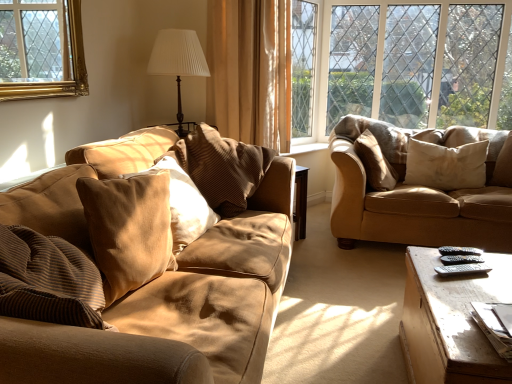
Question: Is suede-like beige pillow at right, positioned as the fourth pillow in left-to-right order, facing away from brown fabric curtain at center?

Choices:
 (A) yes
 (B) no

Answer: (A)

Question: Are suede-like beige pillow at right, positioned as the fourth pillow in left-to-right order, and brown fabric curtain at center beside each other?

Choices:
 (A) yes
 (B) no

Answer: (B)

Question: Is suede-like beige pillow at right, positioned as the fourth pillow in left-to-right order, further to camera compared to brown fabric curtain at center?

Choices:
 (A) yes
 (B) no

Answer: (A)

Question: Considering the relative sizes of suede-like beige pillow at right, which is the second pillow from right to left, and brown fabric curtain at center in the image provided, is suede-like beige pillow at right, which is the second pillow from right to left, thinner than brown fabric curtain at center?

Choices:
 (A) yes
 (B) no

Answer: (B)

Question: Is brown fabric curtain at center surrounded by suede-like beige pillow at right, which is the second pillow from right to left?

Choices:
 (A) yes
 (B) no

Answer: (B)

Question: Based on their sizes in the image, would you say beige soft cushion at right, the fifth pillow in the left-to-right sequence, is bigger or smaller than white pleated fabric at upper center?

Choices:
 (A) big
 (B) small

Answer: (B)

Question: Would you say beige soft cushion at right, the 1th pillow when ordered from right to left, is to the left or to the right of white pleated fabric at upper center in the picture?

Choices:
 (A) right
 (B) left

Answer: (A)

Question: Is beige soft cushion at right, the 1th pillow when ordered from right to left, wider or thinner than white pleated fabric at upper center?

Choices:
 (A) wide
 (B) thin

Answer: (B)

Question: From a real-world perspective, is beige soft cushion at right, the fifth pillow in the left-to-right sequence, above or below white pleated fabric at upper center?

Choices:
 (A) below
 (B) above

Answer: (A)

Question: From a real-world perspective, relative to beige soft cushion at right, the 1th pillow when ordered from right to left, is wooden coffee table at lower right vertically above or below?

Choices:
 (A) below
 (B) above

Answer: (A)

Question: In terms of height, does wooden coffee table at lower right look taller or shorter compared to beige soft cushion at right, the 1th pillow when ordered from right to left?

Choices:
 (A) tall
 (B) short

Answer: (A)

Question: Is wooden coffee table at lower right spatially inside beige soft cushion at right, the 1th pillow when ordered from right to left, or outside of it?

Choices:
 (A) inside
 (B) outside

Answer: (B)

Question: Considering the positions of wooden coffee table at lower right and beige soft cushion at right, the 1th pillow when ordered from right to left, in the image, is wooden coffee table at lower right wider or thinner than beige soft cushion at right, the 1th pillow when ordered from right to left,?

Choices:
 (A) thin
 (B) wide

Answer: (B)

Question: Is point (414, 147) closer or farther from the camera than point (413, 248)?

Choices:
 (A) farther
 (B) closer

Answer: (A)

Question: Based on their sizes in the image, would you say beige soft cushion at right, the 1th pillow when ordered from right to left, is bigger or smaller than wooden coffee table at lower right?

Choices:
 (A) small
 (B) big

Answer: (A)